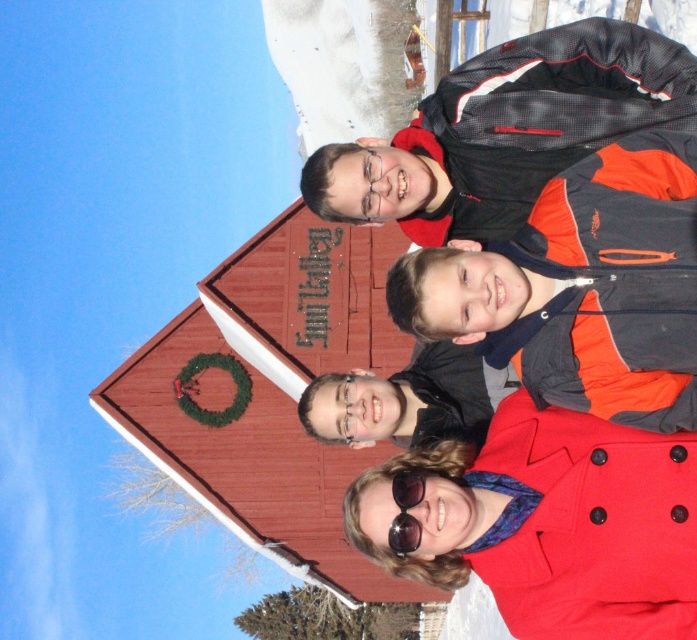
Question: Among these points, which one is farthest from the camera?

Choices:
 (A) (503, 412)
 (B) (415, 504)

Answer: (A)

Question: Which of the following is the farthest from the observer?

Choices:
 (A) (657, 548)
 (B) (413, 547)
 (C) (560, 51)
 (D) (346, 432)

Answer: (D)

Question: Is red matte coat at lower right to the left of orange and black jacket at upper right from the viewer's perspective?

Choices:
 (A) yes
 (B) no

Answer: (B)

Question: Which point is closer to the camera taking this photo?

Choices:
 (A) (404, 474)
 (B) (344, 145)
 (C) (344, 440)
 (D) (480, 484)

Answer: (A)

Question: Can you confirm if orange and black jacket at upper right is positioned to the left of clear plastic goggles at center?

Choices:
 (A) yes
 (B) no

Answer: (B)

Question: Is black reflective sunglasses at center to the right of clear plastic goggles at center from the viewer's perspective?

Choices:
 (A) no
 (B) yes

Answer: (B)